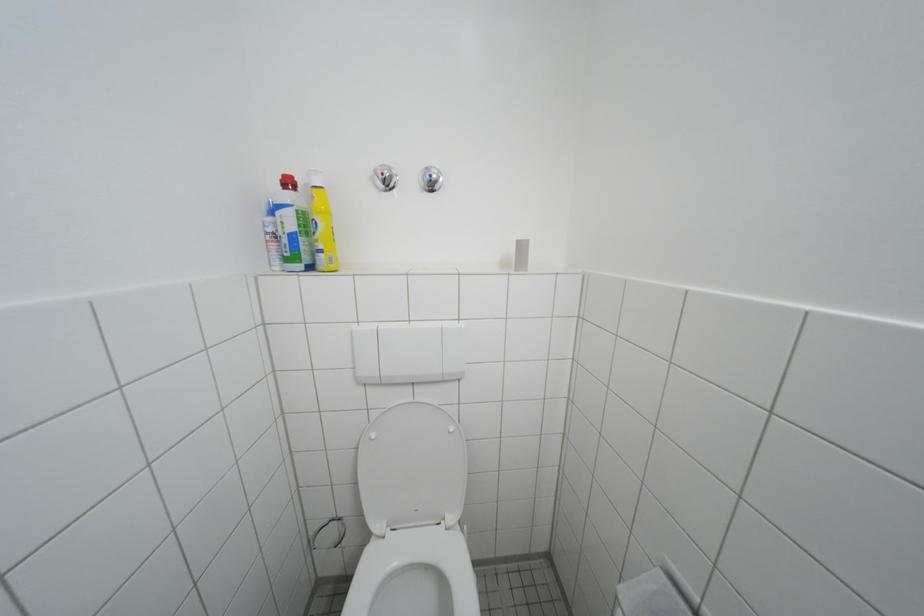
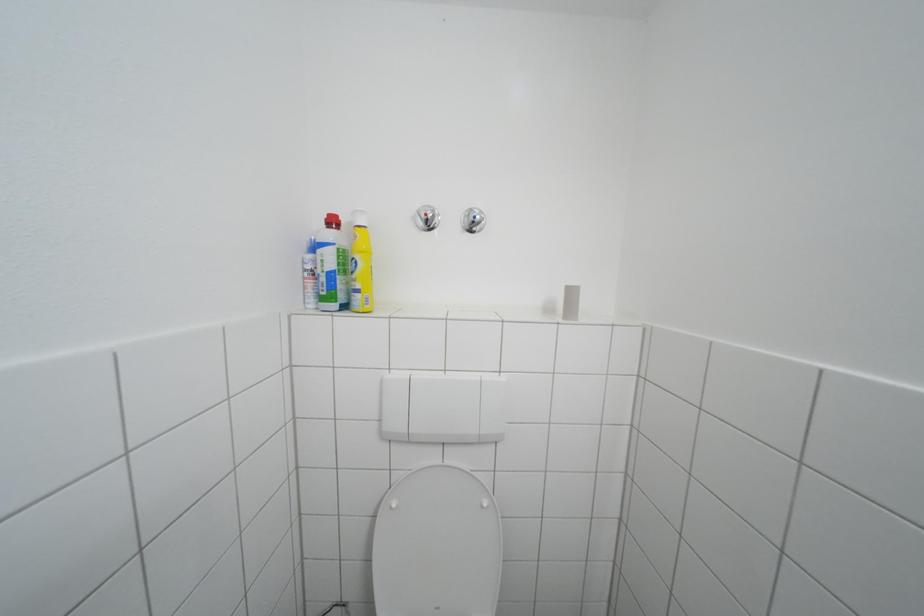
In a continuous first-person perspective shot, in which direction is the camera moving?

The cameraman walked toward left, forward.